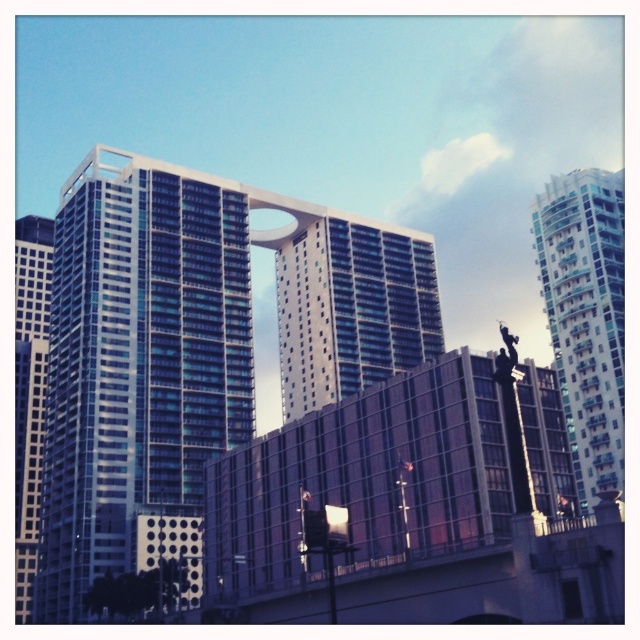
Question: Estimate the real-world distances between objects in this image. Which object is farther from the glassy blue skyscraper at left?

Choices:
 (A) white glass building at right
 (B) glassy blue skyscraper at center

Answer: (A)

Question: Can you confirm if glassy blue skyscraper at center is smaller than white glass building at right?

Choices:
 (A) yes
 (B) no

Answer: (B)

Question: Among these objects, which one is nearest to the camera?

Choices:
 (A) glassy blue skyscraper at left
 (B) white glass building at right
 (C) glassy blue skyscraper at center

Answer: (B)

Question: Can you confirm if white glass building at right is wider than glassy blue skyscraper at left?

Choices:
 (A) no
 (B) yes

Answer: (A)

Question: Which of the following is the closest to the observer?

Choices:
 (A) (19, 515)
 (B) (364, 268)

Answer: (A)

Question: Considering the relative positions of white glass building at right and glassy blue skyscraper at left in the image provided, where is white glass building at right located with respect to glassy blue skyscraper at left?

Choices:
 (A) below
 (B) above

Answer: (A)